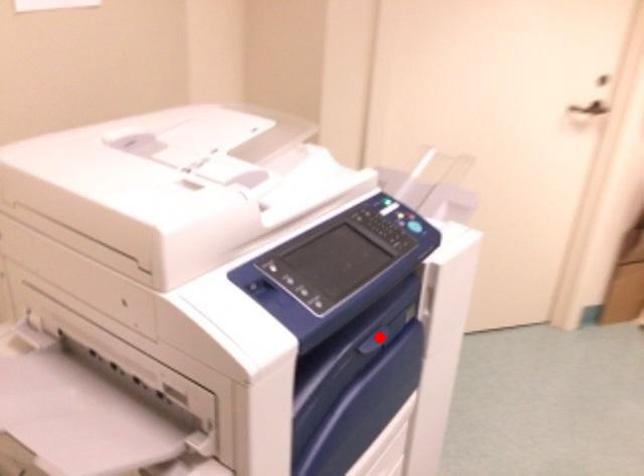
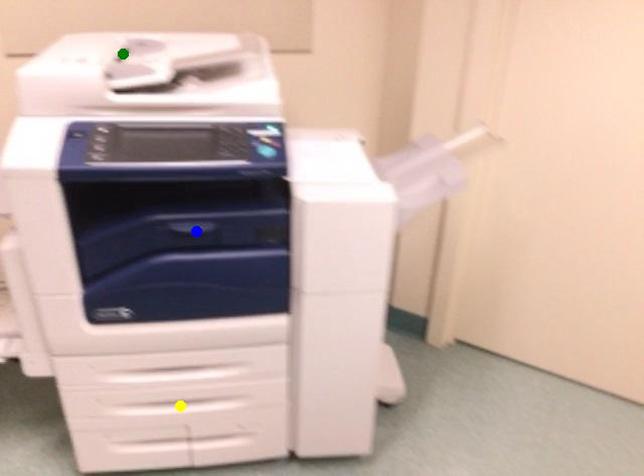
Question: I am providing you with two images of the same scene from different viewpoints. A red point is marked on the first image. You are given multiple points on the second image. Which point in image 2 is actually the same real-world point as the red point in image 1?

Choices:
 (A) yellow point
 (B) blue point
 (C) green point

Answer: (B)